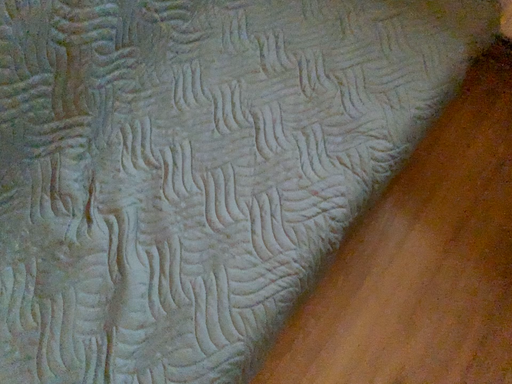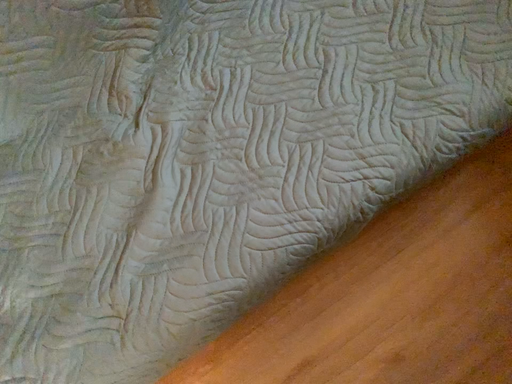
Question: How did the camera likely rotate when shooting the video?

Choices:
 (A) rotated left
 (B) rotated right

Answer: (A)